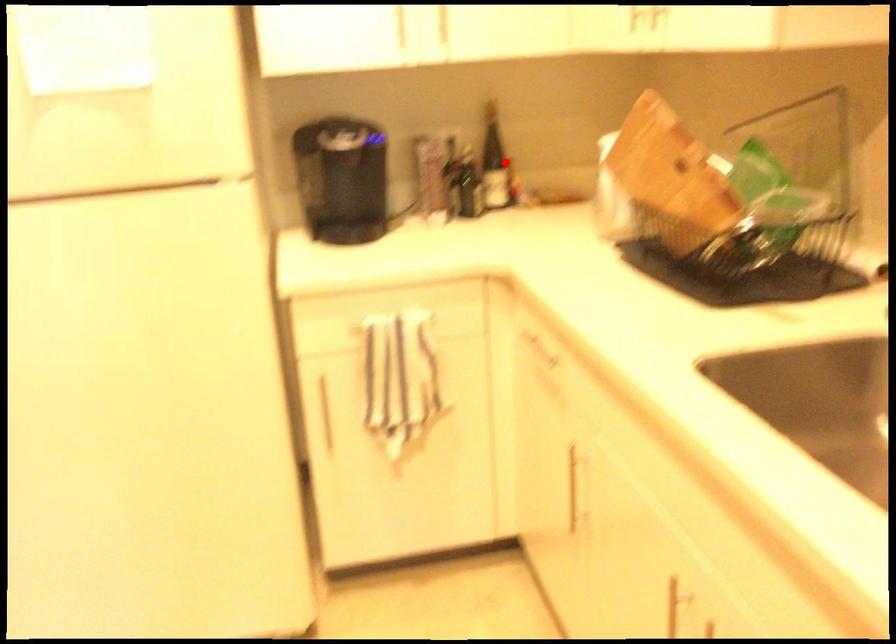
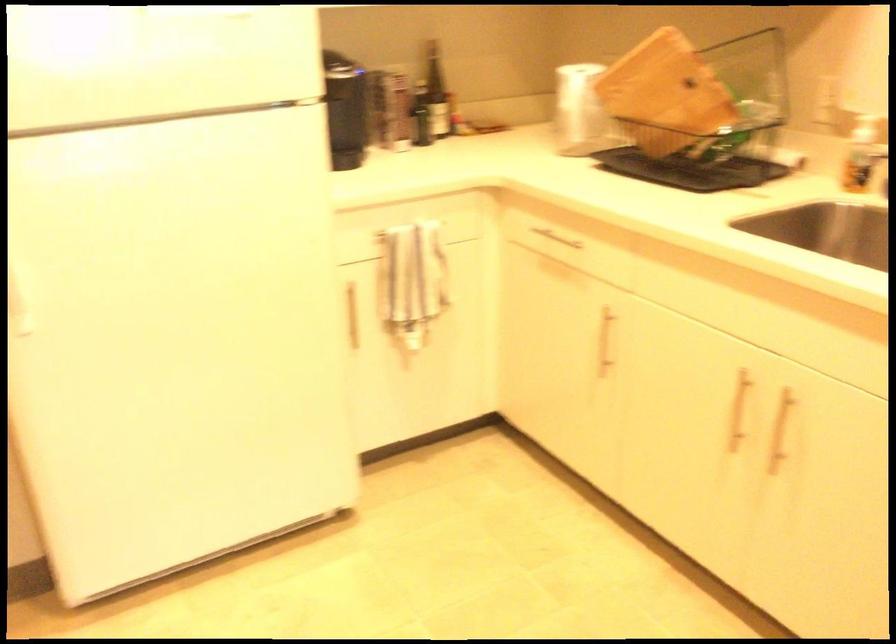
The point at the highlighted location is marked in the first image. Where is the corresponding point in the second image?

(435, 91)